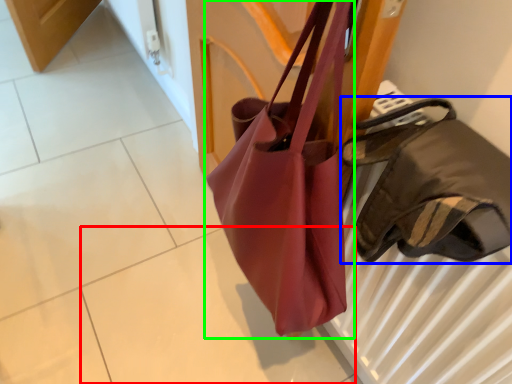
Question: Which object is the closest to the tile (highlighted by a red box)? Choose among these: handbag (highlighted by a blue box) or handbag (highlighted by a green box).

Choices:
 (A) handbag
 (B) handbag

Answer: (B)